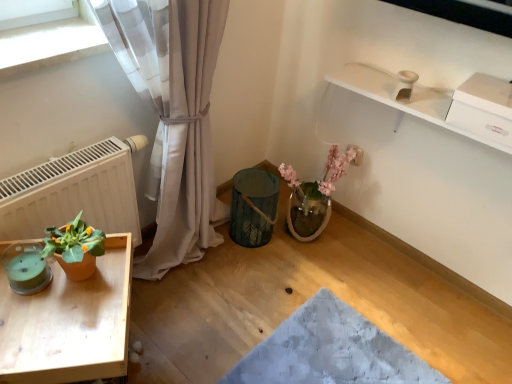
Question: From a real-world perspective, is terracotta pot at left positioned above or below white matte radiator at left?

Choices:
 (A) below
 (B) above

Answer: (B)

Question: In terms of height, does terracotta pot at left look taller or shorter compared to white matte radiator at left?

Choices:
 (A) short
 (B) tall

Answer: (A)

Question: Which is farther from the white matte radiator at left?

Choices:
 (A) terracotta pot at left
 (B) teal glass candle at lower left
 (C) wooden tray at lower left

Answer: (C)

Question: Based on their relative distances, which object is farther from the teal glass candle at lower left?

Choices:
 (A) wooden tray at lower left
 (B) terracotta pot at left
 (C) white matte radiator at left

Answer: (C)